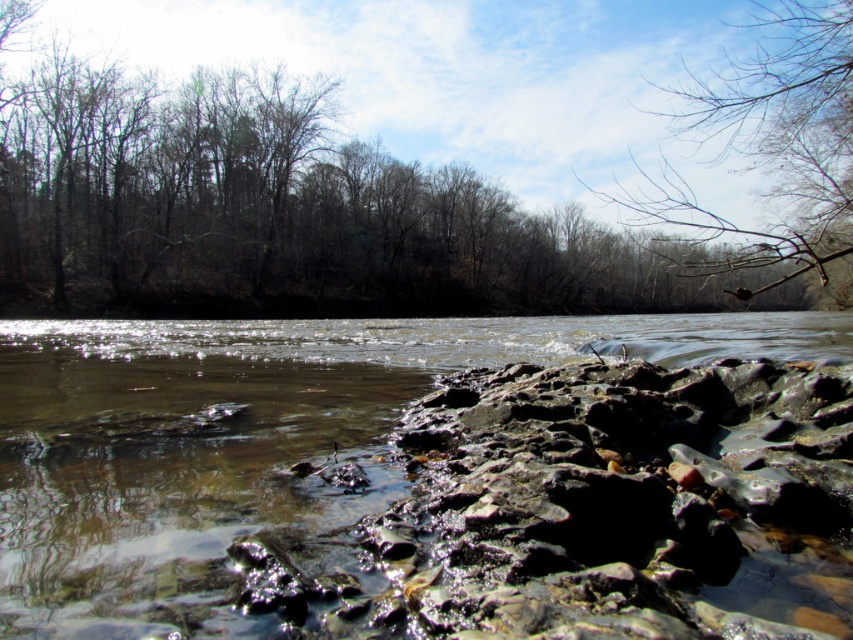
Question: Which object appears closest to the camera in this image?

Choices:
 (A) brown leafless trees at upper center
 (B) bare branches at upper right

Answer: (B)

Question: Can you confirm if brown leafless trees at upper center is positioned to the left of bare branches at upper right?

Choices:
 (A) no
 (B) yes

Answer: (B)

Question: Which point is closer to the camera?

Choices:
 (A) (776, 342)
 (B) (727, 268)

Answer: (B)

Question: Is clear water at center thinner than bare branches at upper right?

Choices:
 (A) yes
 (B) no

Answer: (A)

Question: Which point is farther to the camera?

Choices:
 (A) (788, 61)
 (B) (450, 198)
 (C) (747, 440)

Answer: (B)

Question: Does clear water at center lie in front of brown leafless trees at upper center?

Choices:
 (A) no
 (B) yes

Answer: (B)